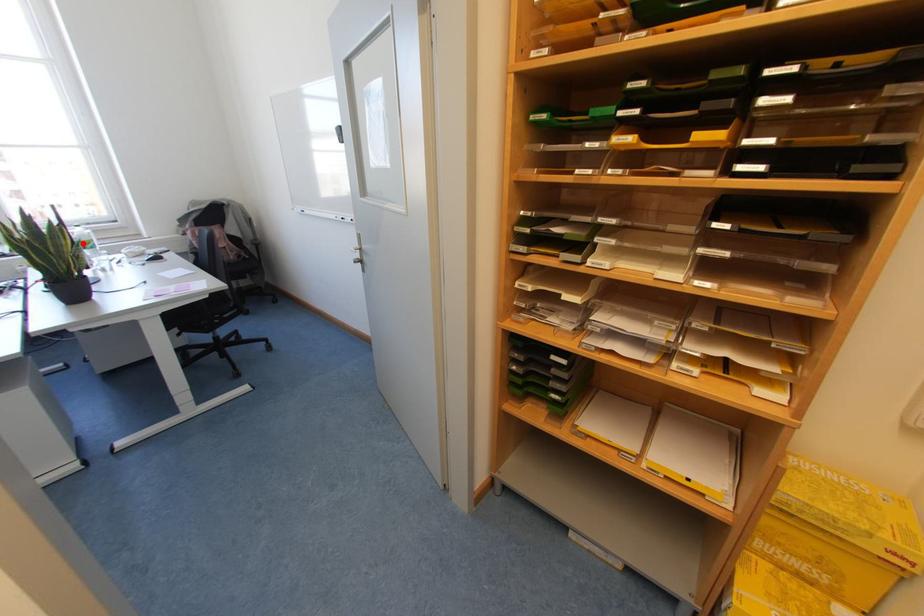
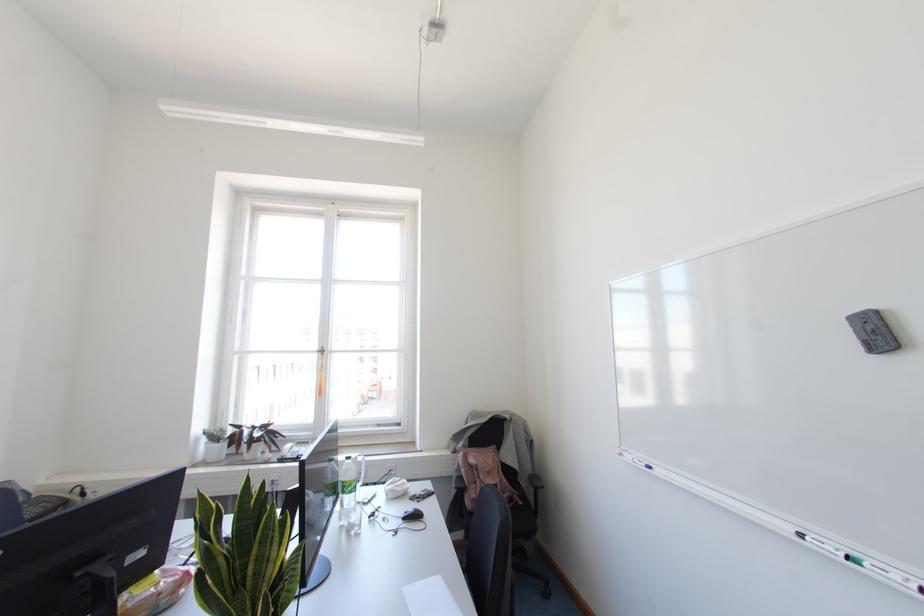
Locate, in the second image, the point that corresponds to the highlighted location in the first image.

(343, 485)